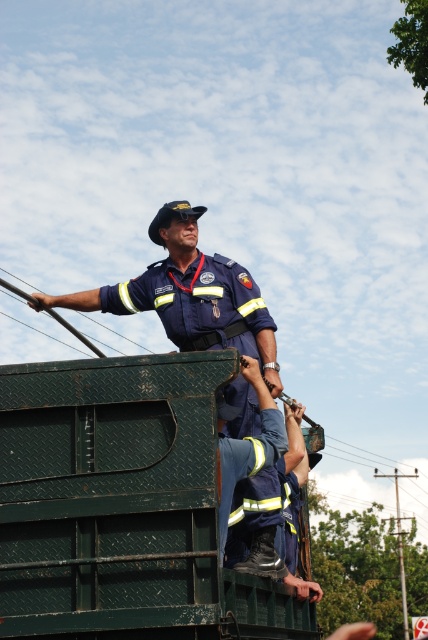
You are a safety inspector standing at the camera position. You need to inspect the green diamond plate garbage truck at upper center. Can you reach it by walking directly towards it without any obstacles? The maximum distance you can walk is 10 meters.

The green diamond plate garbage truck at upper center is 9.22 meters away from camera, so yes, you can reach it by walking directly towards it since the distance is within your 10 meters limit.

You are a pedestrian standing on the sidewalk. You see the green diamond plate garbage truck at upper center and the navy blue uniform at upper center. Which object is positioned more to the left?

The green diamond plate garbage truck at upper center is positioned more to the left than the navy blue uniform at upper center.

You are a delivery person who needs to park your vehicle near the green diamond plate garbage truck at upper center. The parking spot is located at point 0.800, 0.300. Can you safely park your vehicle there?

The green diamond plate garbage truck at upper center is located at point (x=124, y=506). The parking spot at (x=128, y=512) is very close, but you should check for any restrictions or obstructions before parking to ensure safety.